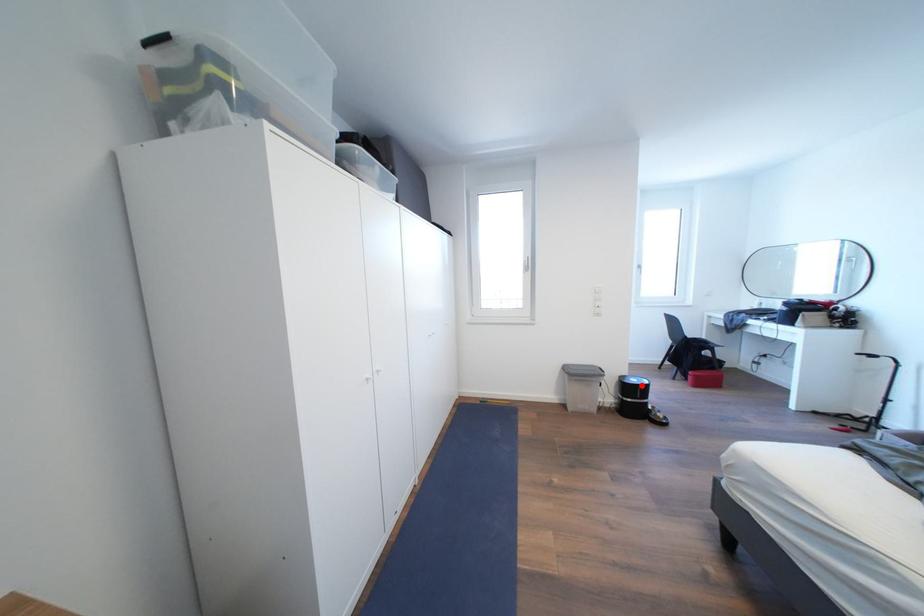
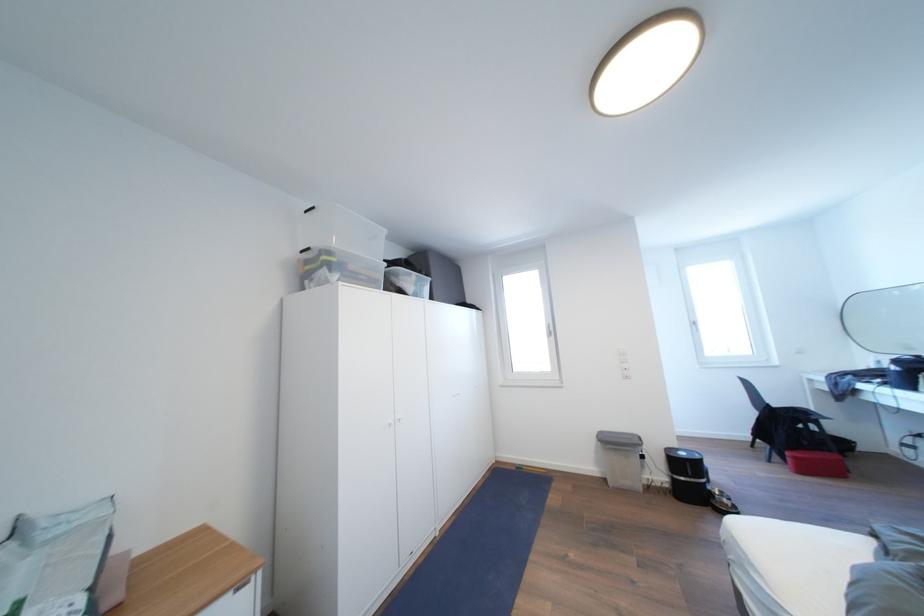
Question: I am providing you with two images of the same scene from different viewpoints. A red point is marked on the first image. Is the red point's position out of view in image 2?

Choices:
 (A) Yes
 (B) No

Answer: (B)